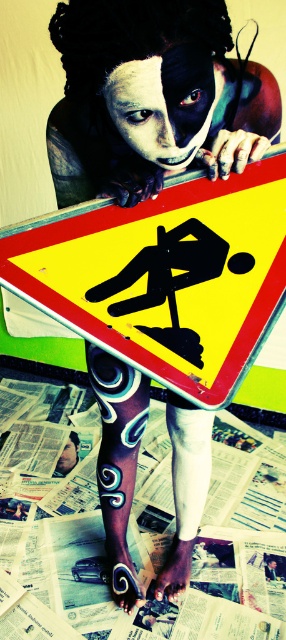
Question: Observing the image, what is the correct spatial positioning of yellow reflective plastic at center in reference to black matte face at center?

Choices:
 (A) below
 (B) above

Answer: (A)

Question: Is yellow paper at center thinner than black matte face at center?

Choices:
 (A) no
 (B) yes

Answer: (A)

Question: Where is yellow paper at center located in relation to white matte skin at lower left in the image?

Choices:
 (A) right
 (B) left

Answer: (A)

Question: Based on their relative distances, which object is farther from the white matte skin at lower left?

Choices:
 (A) yellow reflective plastic at center
 (B) black matte face at center

Answer: (B)

Question: Estimate the real-world distances between objects in this image. Which object is farther from the yellow reflective plastic at center?

Choices:
 (A) yellow paper at center
 (B) white matte skin at lower left
 (C) black matte face at center

Answer: (B)

Question: Which object is positioned farthest from the yellow paper at center?

Choices:
 (A) white matte skin at lower left
 (B) black matte face at center
 (C) yellow reflective plastic at center

Answer: (B)